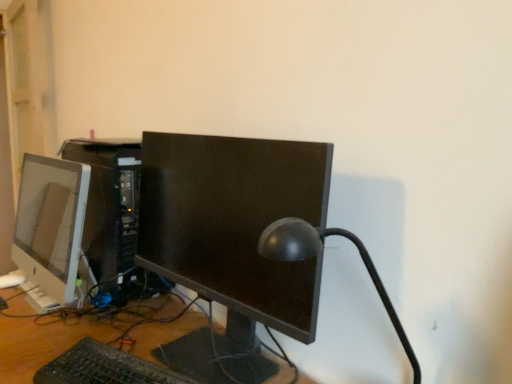
Find the location of `free space in front of satin black computer tower at center`. free space in front of satin black computer tower at center is located at coordinates (73, 321).